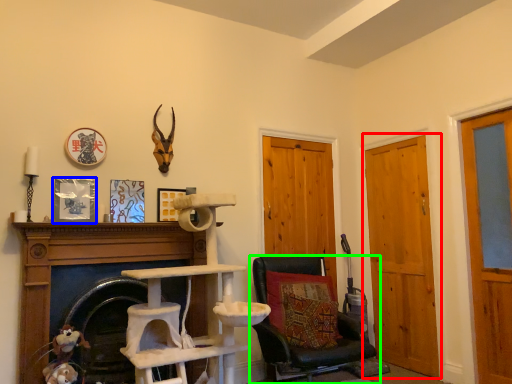
Question: Which is farther away from door (highlighted by a red box)? picture frame (highlighted by a blue box) or chair (highlighted by a green box)?

Choices:
 (A) picture frame
 (B) chair

Answer: (A)